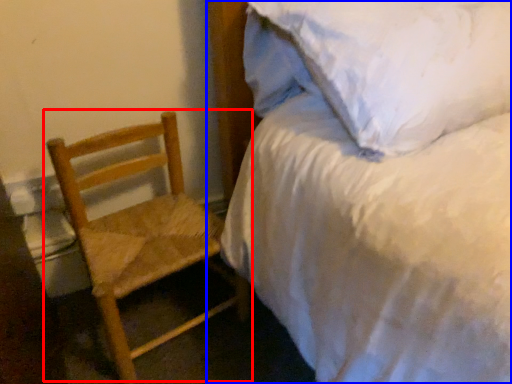
Question: Which of the following is the farthest to the observer, chair (highlighted by a red box) or bed (highlighted by a blue box)?

Choices:
 (A) chair
 (B) bed

Answer: (A)